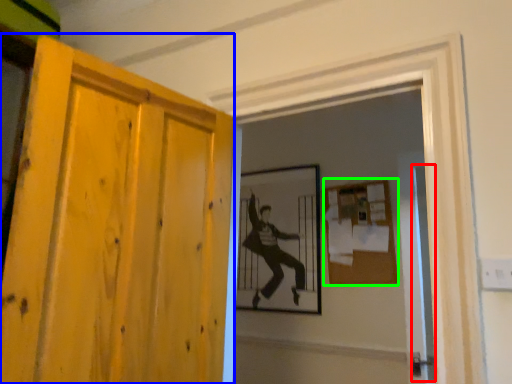
Question: Considering the real-world distances, which object is closest to screen door (highlighted by a red box)? door (highlighted by a blue box) or bulletin board (highlighted by a green box).

Choices:
 (A) door
 (B) bulletin board

Answer: (B)